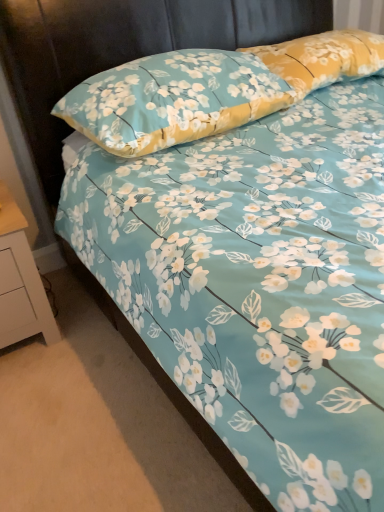
Locate an element on the screen. The height and width of the screenshot is (512, 384). white painted wood nightstand at lower left is located at coordinates (20, 281).

Describe the element at coordinates (20, 281) in the screenshot. The height and width of the screenshot is (512, 384). I see `white painted wood nightstand at lower left` at that location.

This screenshot has width=384, height=512. What are the coordinates of `yellow floral pillow at upper right, which is counted as the 2th pillow, starting from the left` in the screenshot? It's located at (322, 58).

From a real-world perspective, is white painted wood nightstand at lower left under yellow floral pillow at upper right, which is counted as the 2th pillow, starting from the left?

Correct, in the physical world, white painted wood nightstand at lower left is lower than yellow floral pillow at upper right, which is counted as the 2th pillow, starting from the left.

Considering the relative sizes of white painted wood nightstand at lower left and yellow floral pillow at upper right, which is the 1th pillow in right-to-left order, in the image provided, is white painted wood nightstand at lower left thinner than yellow floral pillow at upper right, which is the 1th pillow in right-to-left order,?

No, white painted wood nightstand at lower left is not thinner than yellow floral pillow at upper right, which is the 1th pillow in right-to-left order.

Does point (29, 267) lie behind point (312, 85)?

No.

Looking at their sizes, would you say yellow floral pillow at upper right, which is counted as the 2th pillow, starting from the left, is wider or thinner than white painted wood nightstand at lower left?

yellow floral pillow at upper right, which is counted as the 2th pillow, starting from the left, is thinner than white painted wood nightstand at lower left.

Could you tell me if yellow floral pillow at upper right, which is counted as the 2th pillow, starting from the left, is turned towards white painted wood nightstand at lower left?

No, yellow floral pillow at upper right, which is counted as the 2th pillow, starting from the left, does not turn towards white painted wood nightstand at lower left.

Considering the sizes of yellow floral pillow at upper right, which is the 1th pillow in right-to-left order, and white painted wood nightstand at lower left in the image, is yellow floral pillow at upper right, which is the 1th pillow in right-to-left order, bigger or smaller than white painted wood nightstand at lower left?

In the image, yellow floral pillow at upper right, which is the 1th pillow in right-to-left order, appears to be smaller than white painted wood nightstand at lower left.

Could white painted wood nightstand at lower left be considered to be inside yellow floral pillow at upper right, which is the 1th pillow in right-to-left order?

No.

Is floral fabric pillow at upper center, the first pillow from the left, closer to the viewer compared to white painted wood nightstand at lower left?

Yes, floral fabric pillow at upper center, the first pillow from the left, is closer to the viewer.

Is floral fabric pillow at upper center, the second pillow positioned from the right, facing towards white painted wood nightstand at lower left?

No, floral fabric pillow at upper center, the second pillow positioned from the right, is not aimed at white painted wood nightstand at lower left.

Is there a large distance between floral fabric pillow at upper center, the first pillow from the left, and white painted wood nightstand at lower left?

No, there isn't a large distance between floral fabric pillow at upper center, the first pillow from the left, and white painted wood nightstand at lower left.

Locate an element on the screen. nightstand on the left of floral fabric pillow at upper center, the first pillow from the left is located at coordinates (20, 281).

Considering the relative sizes of white painted wood nightstand at lower left and floral fabric pillow at upper center, the first pillow from the left, in the image provided, is white painted wood nightstand at lower left bigger than floral fabric pillow at upper center, the first pillow from the left,?

No.

How many degrees apart are the facing directions of white painted wood nightstand at lower left and floral fabric pillow at upper center, the first pillow from the left?

The angle between the facing direction of white painted wood nightstand at lower left and the facing direction of floral fabric pillow at upper center, the first pillow from the left, is 0.801 degrees.

Does white painted wood nightstand at lower left have a lesser height compared to floral fabric pillow at upper center, the first pillow from the left?

Incorrect, the height of white painted wood nightstand at lower left does not fall short of that of floral fabric pillow at upper center, the first pillow from the left.

Is the position of white painted wood nightstand at lower left more distant than that of floral fabric pillow at upper center, the second pillow positioned from the right?

Yes, white painted wood nightstand at lower left is further from the camera.

Is point (171, 75) closer or farther from the camera than point (274, 50)?

Point (171, 75) is closer to the camera than point (274, 50).

From the image's perspective, between floral fabric pillow at upper center, the first pillow from the left, and yellow floral pillow at upper right, which is counted as the 2th pillow, starting from the left, which one is located above?

yellow floral pillow at upper right, which is counted as the 2th pillow, starting from the left, appears higher in the image.

Is floral fabric pillow at upper center, the second pillow positioned from the right, closer to camera compared to yellow floral pillow at upper right, which is the 1th pillow in right-to-left order?

Yes, floral fabric pillow at upper center, the second pillow positioned from the right, is closer to the viewer.

Is floral fabric pillow at upper center, the first pillow from the left, at the back of yellow floral pillow at upper right, which is the 1th pillow in right-to-left order?

No, yellow floral pillow at upper right, which is the 1th pillow in right-to-left order, is not facing away from floral fabric pillow at upper center, the first pillow from the left.

How different are the orientations of yellow floral pillow at upper right, which is the 1th pillow in right-to-left order, and floral fabric pillow at upper center, the second pillow positioned from the right, in degrees?

There is a 3.14-degree angle between the facing directions of yellow floral pillow at upper right, which is the 1th pillow in right-to-left order, and floral fabric pillow at upper center, the second pillow positioned from the right.

Which of these two, yellow floral pillow at upper right, which is the 1th pillow in right-to-left order, or floral fabric pillow at upper center, the second pillow positioned from the right, is thinner?

With smaller width is yellow floral pillow at upper right, which is the 1th pillow in right-to-left order.

Locate an element on the screen. This screenshot has width=384, height=512. pillow that is the 2nd one above the white painted wood nightstand at lower left (from a real-world perspective) is located at coordinates (322, 58).

Locate an element on the screen. The image size is (384, 512). nightstand beneath the yellow floral pillow at upper right, which is the 1th pillow in right-to-left order (from a real-world perspective) is located at coordinates (20, 281).

Looking at the image, which one is located closer to yellow floral pillow at upper right, which is counted as the 2th pillow, starting from the left, floral fabric pillow at upper center, the second pillow positioned from the right, or white painted wood nightstand at lower left?

floral fabric pillow at upper center, the second pillow positioned from the right.

Based on their spatial positions, is white painted wood nightstand at lower left or floral fabric pillow at upper center, the first pillow from the left, further from yellow floral pillow at upper right, which is counted as the 2th pillow, starting from the left?

Among the two, white painted wood nightstand at lower left is located further to yellow floral pillow at upper right, which is counted as the 2th pillow, starting from the left.

Estimate the real-world distances between objects in this image. Which object is closer to floral fabric pillow at upper center, the second pillow positioned from the right, yellow floral pillow at upper right, which is counted as the 2th pillow, starting from the left, or white painted wood nightstand at lower left?

yellow floral pillow at upper right, which is counted as the 2th pillow, starting from the left, lies closer to floral fabric pillow at upper center, the second pillow positioned from the right, than the other object.

Based on their spatial positions, is yellow floral pillow at upper right, which is counted as the 2th pillow, starting from the left, or floral fabric pillow at upper center, the second pillow positioned from the right, further from white painted wood nightstand at lower left?

yellow floral pillow at upper right, which is counted as the 2th pillow, starting from the left, lies further to white painted wood nightstand at lower left than the other object.

Based on their spatial positions, is floral fabric pillow at upper center, the second pillow positioned from the right, or yellow floral pillow at upper right, which is counted as the 2th pillow, starting from the left, further from white painted wood nightstand at lower left?

yellow floral pillow at upper right, which is counted as the 2th pillow, starting from the left, is positioned further to the anchor white painted wood nightstand at lower left.

Which object lies nearer to the anchor point floral fabric pillow at upper center, the second pillow positioned from the right, white painted wood nightstand at lower left or yellow floral pillow at upper right, which is the 1th pillow in right-to-left order?

yellow floral pillow at upper right, which is the 1th pillow in right-to-left order, lies closer to floral fabric pillow at upper center, the second pillow positioned from the right, than the other object.

Where is `pillow located between white painted wood nightstand at lower left and yellow floral pillow at upper right, which is counted as the 2th pillow, starting from the left, in the left-right direction`? The width and height of the screenshot is (384, 512). pillow located between white painted wood nightstand at lower left and yellow floral pillow at upper right, which is counted as the 2th pillow, starting from the left, in the left-right direction is located at coordinates (172, 99).